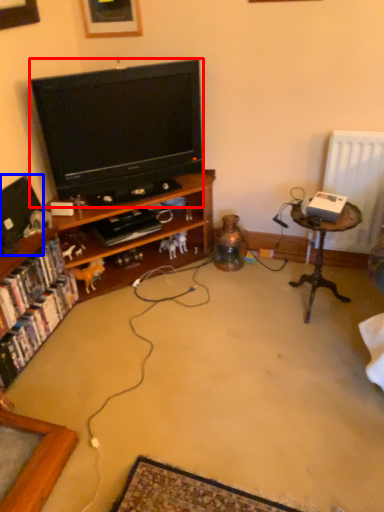
Question: Which point is further to the camera, television (highlighted by a red box) or television (highlighted by a blue box)?

Choices:
 (A) television
 (B) television

Answer: (A)